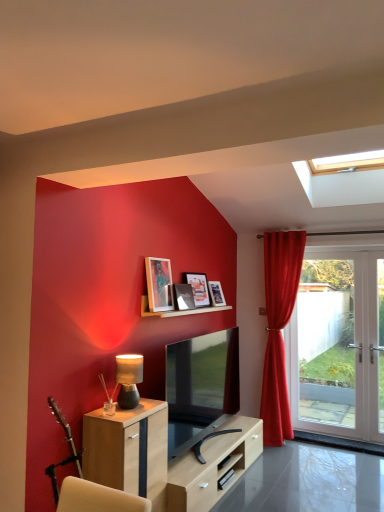
Question: Is the depth of matte wooden picture frame at upper center, acting as the second picture frame starting from the back, greater than that of velvet red curtain at right?

Choices:
 (A) yes
 (B) no

Answer: (B)

Question: From the image's perspective, is matte wooden picture frame at upper center, arranged as the third picture frame when viewed from the front, on velvet red curtain at right?

Choices:
 (A) no
 (B) yes

Answer: (B)

Question: Is matte wooden picture frame at upper center, arranged as the third picture frame when viewed from the front, not near velvet red curtain at right?

Choices:
 (A) no
 (B) yes

Answer: (B)

Question: From a real-world perspective, is matte wooden picture frame at upper center, acting as the second picture frame starting from the back, beneath velvet red curtain at right?

Choices:
 (A) yes
 (B) no

Answer: (B)

Question: From the image's perspective, does matte wooden picture frame at upper center, acting as the second picture frame starting from the back, appear lower than velvet red curtain at right?

Choices:
 (A) yes
 (B) no

Answer: (B)

Question: From a real-world perspective, is matte glass picture frame at upper center, which is counted as the second picture frame, starting from the front, positioned above or below wooden picture frame at upper center, the 1th picture frame when ordered from front to back?

Choices:
 (A) above
 (B) below

Answer: (B)

Question: In the image, is matte glass picture frame at upper center, which appears as the 3th picture frame when viewed from the back, positioned in front of or behind wooden picture frame at upper center, the 1th picture frame when ordered from front to back?

Choices:
 (A) front
 (B) behind

Answer: (B)

Question: Is point (193, 308) closer or farther from the camera than point (157, 266)?

Choices:
 (A) farther
 (B) closer

Answer: (A)

Question: Considering the positions of matte glass picture frame at upper center, which appears as the 3th picture frame when viewed from the back, and wooden picture frame at upper center, placed as the 4th picture frame when sorted from back to front, in the image, is matte glass picture frame at upper center, which appears as the 3th picture frame when viewed from the back, bigger or smaller than wooden picture frame at upper center, placed as the 4th picture frame when sorted from back to front,?

Choices:
 (A) small
 (B) big

Answer: (A)

Question: Considering the positions of light wood cabinet at lower left and wooden shelf at upper center in the image, is light wood cabinet at lower left wider or thinner than wooden shelf at upper center?

Choices:
 (A) thin
 (B) wide

Answer: (B)

Question: From the image's perspective, is light wood cabinet at lower left located above or below wooden shelf at upper center?

Choices:
 (A) above
 (B) below

Answer: (B)

Question: From their relative heights in the image, would you say light wood cabinet at lower left is taller or shorter than wooden shelf at upper center?

Choices:
 (A) short
 (B) tall

Answer: (B)

Question: Would you say light wood cabinet at lower left is to the left or to the right of wooden shelf at upper center in the picture?

Choices:
 (A) left
 (B) right

Answer: (A)

Question: In terms of width, does white glass door at right look wider or thinner when compared to light wood cabinet at lower left?

Choices:
 (A) thin
 (B) wide

Answer: (A)

Question: Choose the correct answer: Is white glass door at right inside light wood cabinet at lower left or outside it?

Choices:
 (A) outside
 (B) inside

Answer: (A)